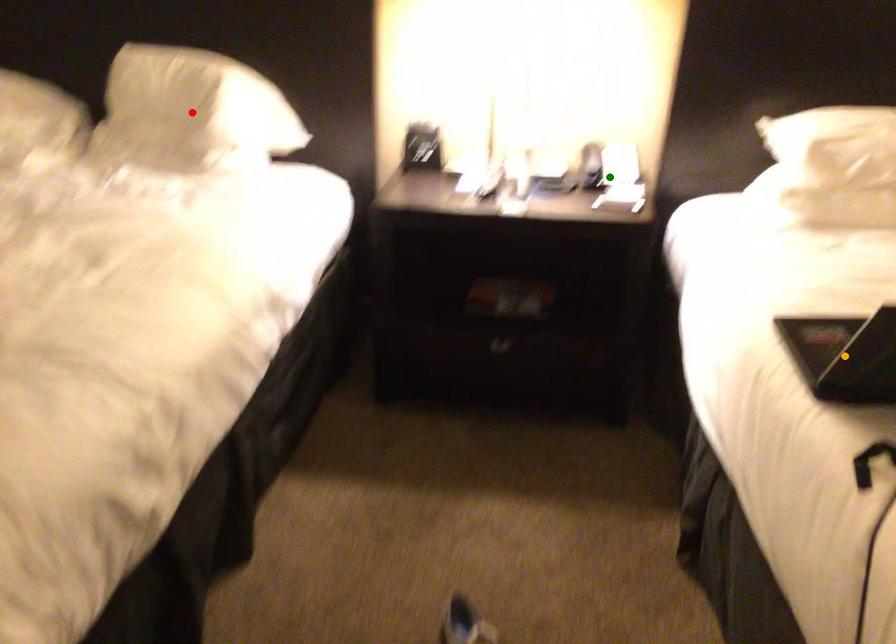
Order these from nearest to farthest:
A) green point
B) red point
C) orange point

1. orange point
2. green point
3. red point